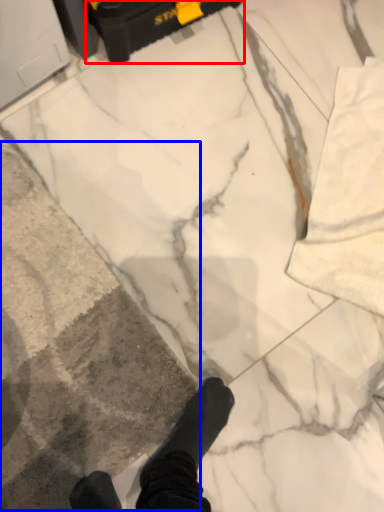
Question: Among these objects, which one is nearest to the camera, equipment (highlighted by a red box) or concrete (highlighted by a blue box)?

Choices:
 (A) equipment
 (B) concrete

Answer: (B)